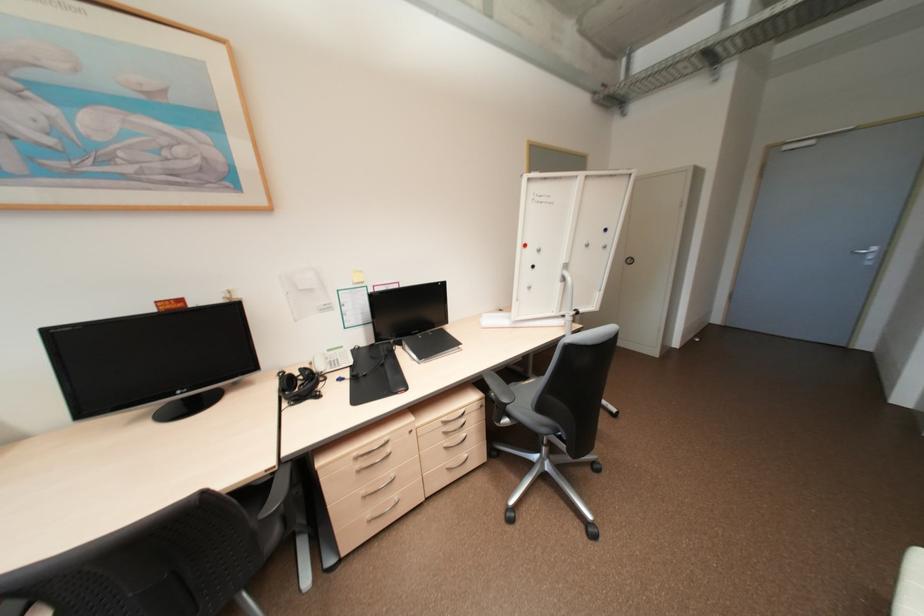
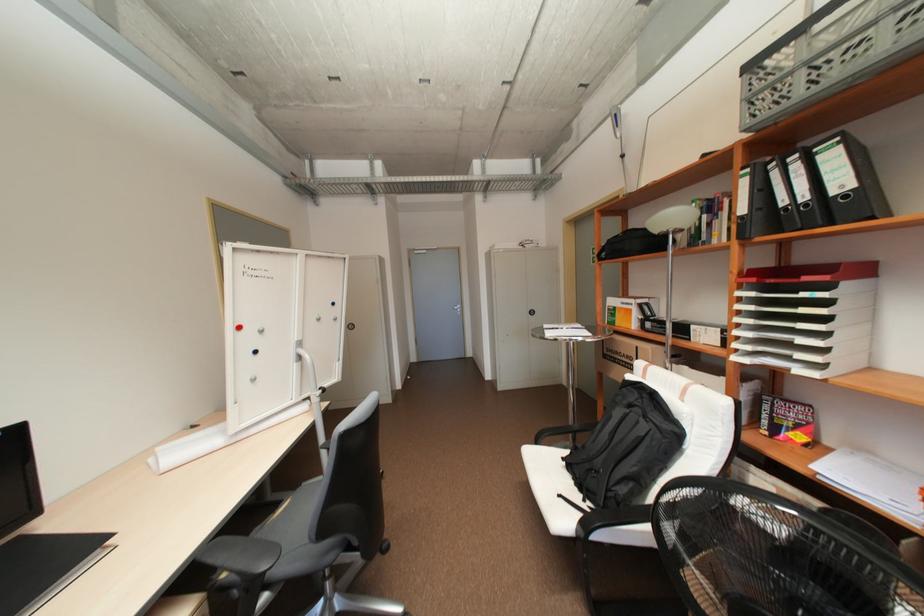
The point at (511, 400) is marked in the first image. Where is the corresponding point in the second image?

(270, 567)